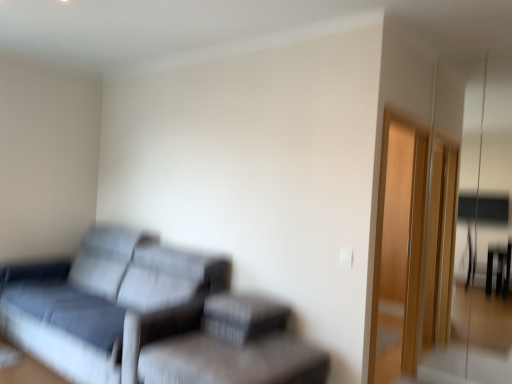
Question: Relative to transparent glass door at right, is textured gray couch at left in front or behind?

Choices:
 (A) front
 (B) behind

Answer: (A)

Question: From the image's perspective, is textured gray couch at left positioned above or below transparent glass door at right?

Choices:
 (A) above
 (B) below

Answer: (B)

Question: Which is nearer to the textured gray swivel chair at lower center?

Choices:
 (A) textured gray couch at left
 (B) textured fabric footrest at lower center
 (C) transparent glass door at right

Answer: (B)

Question: Estimate the real-world distances between objects in this image. Which object is farther from the textured fabric footrest at lower center?

Choices:
 (A) textured gray couch at left
 (B) transparent glass door at right
 (C) textured gray swivel chair at lower center

Answer: (B)